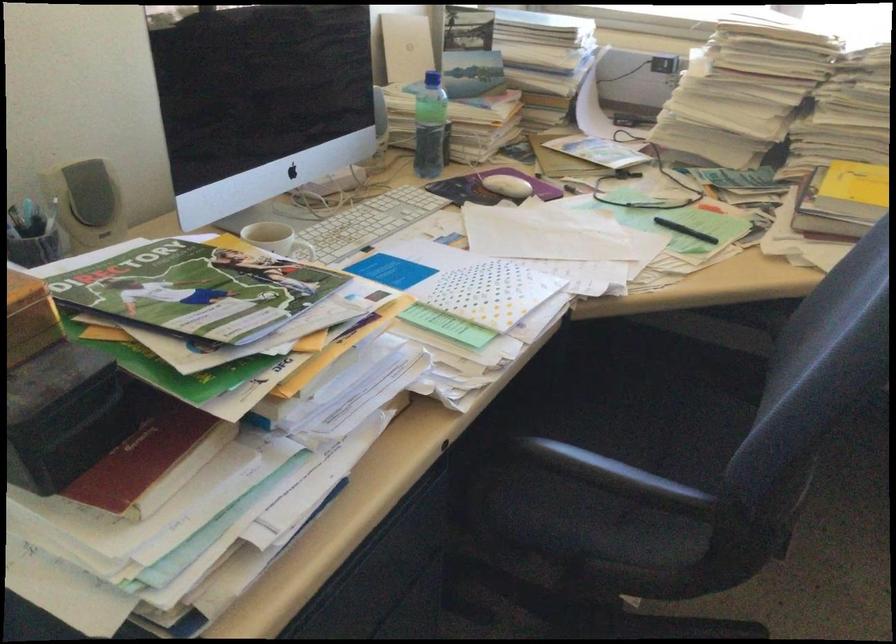
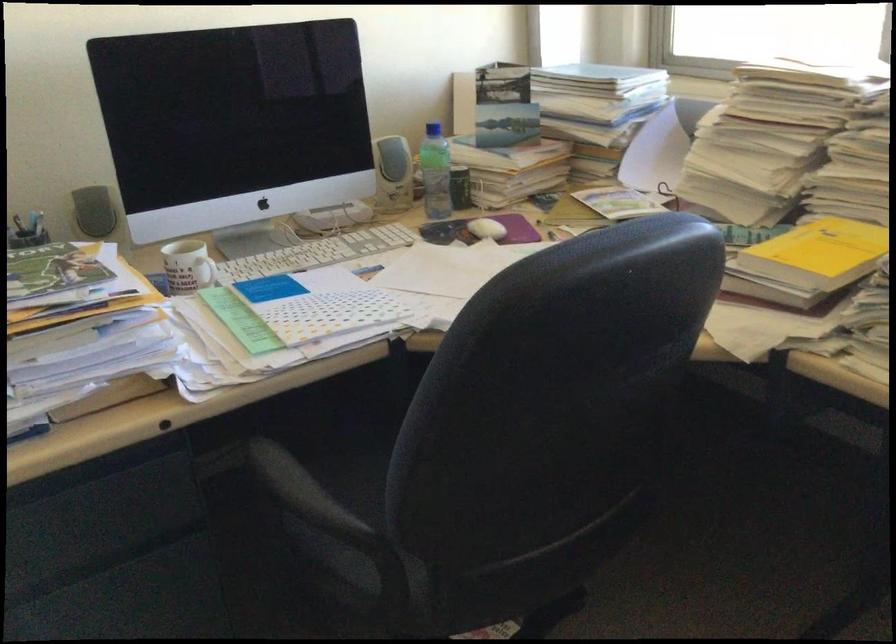
In the second image, find the point that corresponds to the point at 520,185 in the first image.

(487, 229)